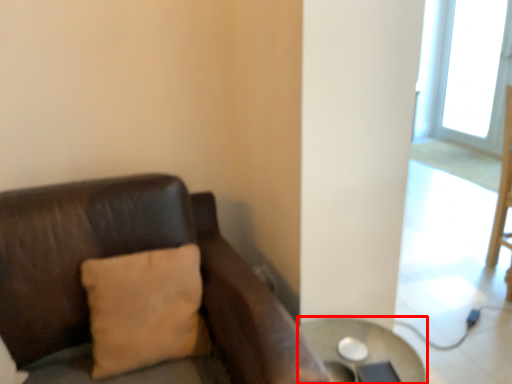
Question: From the image's perspective, what is the correct spatial relationship of table (annotated by the red box) in relation to pillow?

Choices:
 (A) above
 (B) below

Answer: (B)